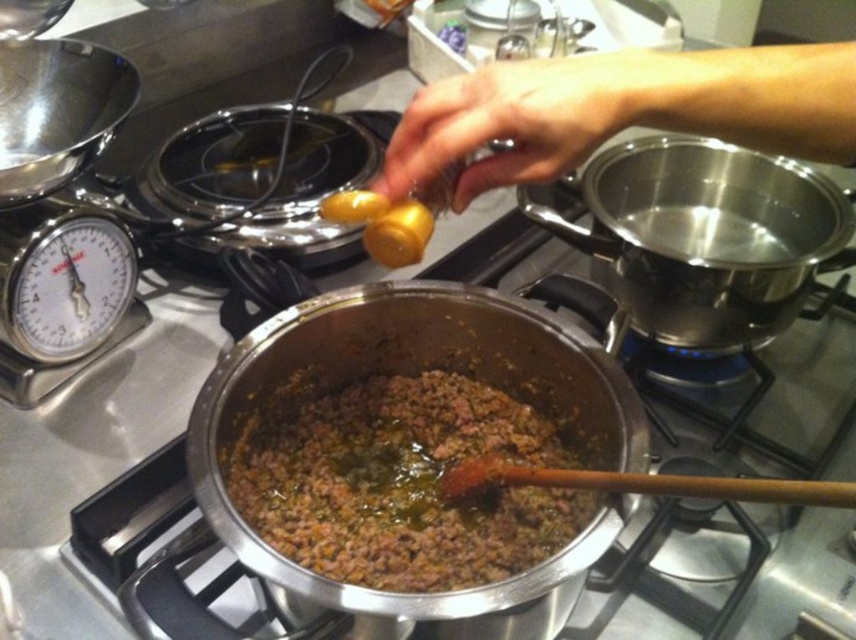
Question: Is brown matte ground meat at center bigger than smooth yellow mustard at upper center?

Choices:
 (A) no
 (B) yes

Answer: (B)

Question: Among these objects, which one is nearest to the camera?

Choices:
 (A) brown matte ground meat at center
 (B) smooth yellow mustard at upper center

Answer: (B)

Question: Is the position of brown matte ground meat at center more distant than that of smooth yellow mustard at upper center?

Choices:
 (A) yes
 (B) no

Answer: (A)

Question: Which point is farther to the camera?

Choices:
 (A) brown matte ground meat at center
 (B) smooth yellow mustard at upper center

Answer: (A)

Question: Can you confirm if brown matte ground meat at center is positioned below smooth yellow mustard at upper center?

Choices:
 (A) yes
 (B) no

Answer: (A)